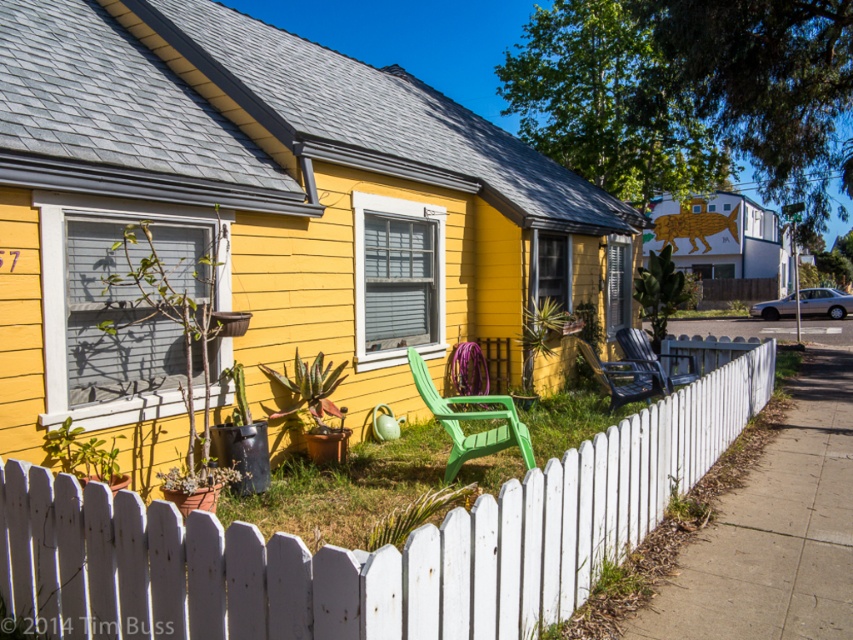
In the scene shown: Is white picket fence at center thinner than green plastic chair at center?

Correct, white picket fence at center's width is less than green plastic chair at center's.

Between point (701, 413) and point (500, 401), which one is positioned in front?

Point (500, 401)

This screenshot has width=853, height=640. Find the location of `white picket fence at center`. white picket fence at center is located at coordinates (367, 552).

Which is more to the left, green plastic chair at center or matte blue plastic chair at center?

From the viewer's perspective, green plastic chair at center appears more on the left side.

Which is more to the right, green plastic chair at center or matte blue plastic chair at center?

Positioned to the right is matte blue plastic chair at center.

In order to click on green plastic chair at center in this screenshot , I will do `click(469, 419)`.

Between white picket fence at center and matte blue plastic chair at center, which one has less height?

white picket fence at center is shorter.

Does white picket fence at center have a larger size compared to matte blue plastic chair at center?

No, white picket fence at center is not bigger than matte blue plastic chair at center.

Where is `white picket fence at center`? The height and width of the screenshot is (640, 853). white picket fence at center is located at coordinates (367, 552).